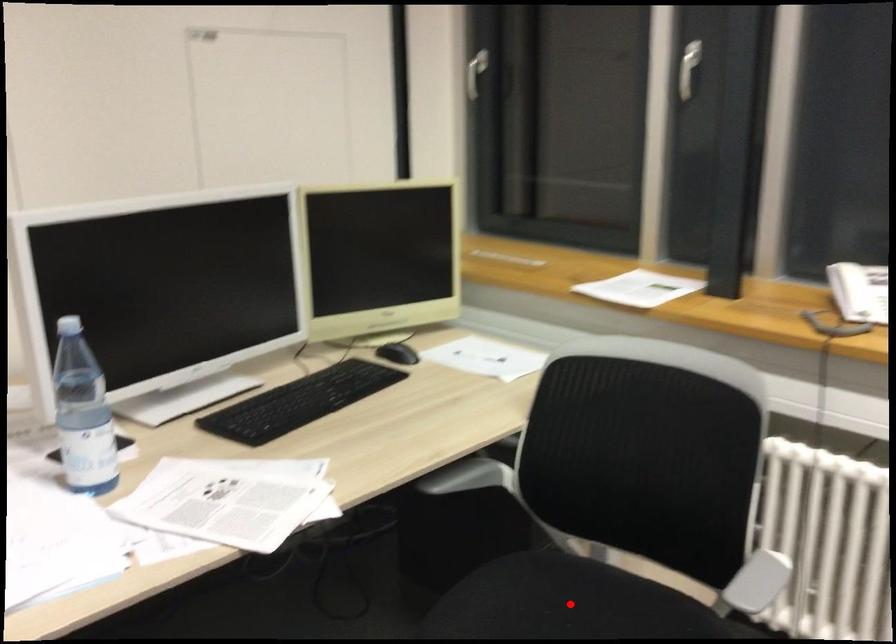
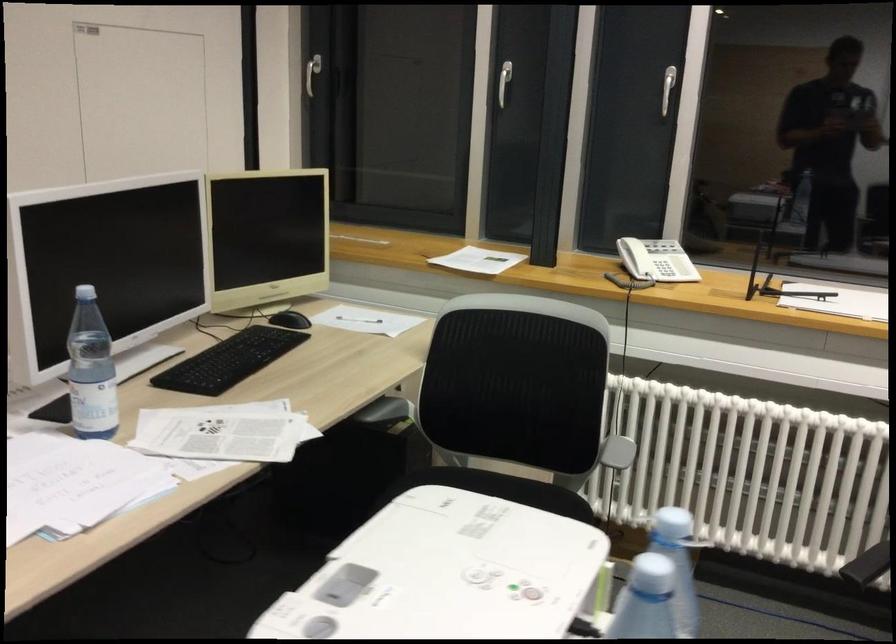
Question: I am providing you with two images of the same scene from different viewpoints. A red point is marked on the first image. At the location where the point appears in image 1, is it still visible in image 2?

Choices:
 (A) Yes
 (B) No

Answer: (B)